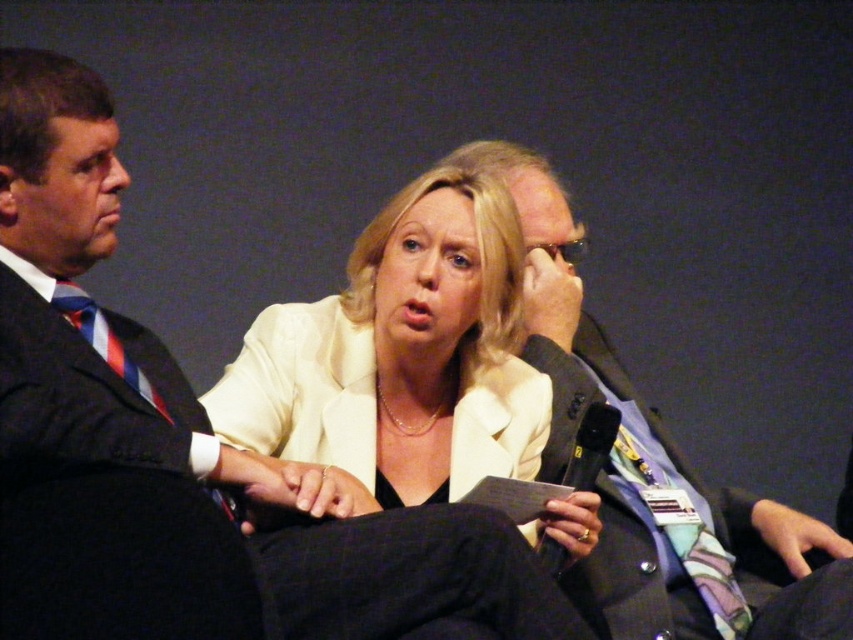
Question: Which point is farther to the camera?

Choices:
 (A) striped silk tie at left
 (B) matte black suit at center
 (C) white matte blazer at center

Answer: (B)

Question: Where is matte black suit at left located in relation to matte black suit at center in the image?

Choices:
 (A) above
 (B) below

Answer: (B)

Question: Which object is the farthest from the matte black suit at left?

Choices:
 (A) white matte blazer at center
 (B) matte black suit at center

Answer: (B)

Question: Among these objects, which one is nearest to the camera?

Choices:
 (A) matte black suit at left
 (B) matte black suit at center

Answer: (A)

Question: Is white matte blazer at center positioned at the back of striped silk tie at left?

Choices:
 (A) no
 (B) yes

Answer: (B)

Question: Can you confirm if matte black suit at left is smaller than striped silk tie at left?

Choices:
 (A) yes
 (B) no

Answer: (B)